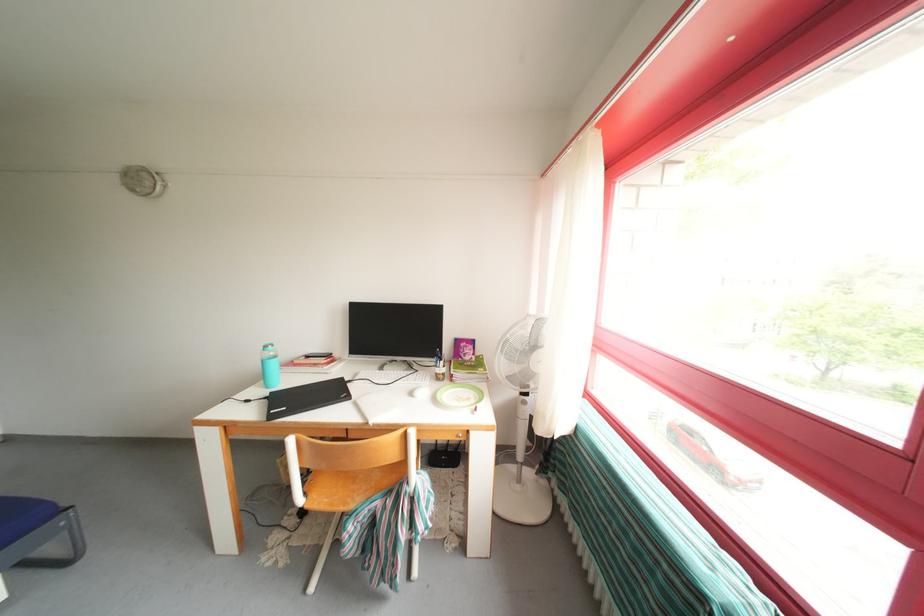
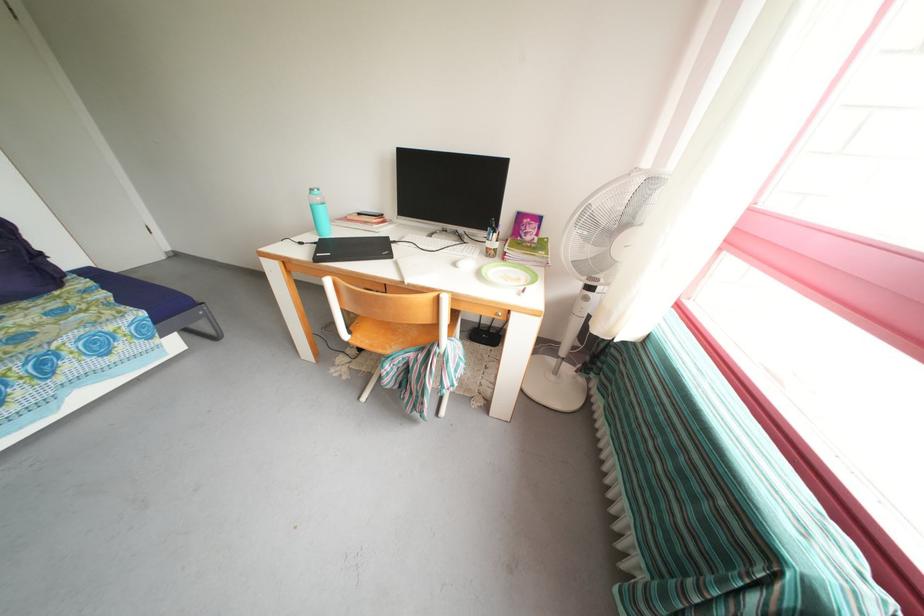
Where in the second image is the point corresponding to (273,403) from the first image?

(322, 249)